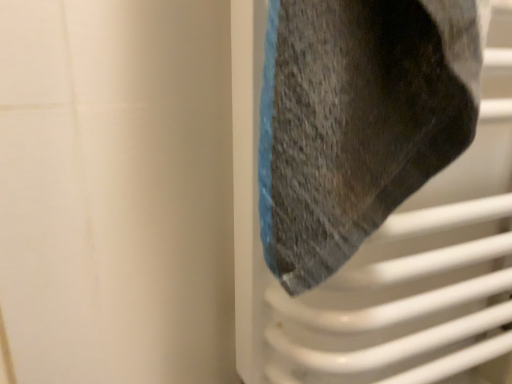
Locate an element on the screen. textured gray towel at upper right is located at coordinates (357, 120).

What do you see at coordinates (357, 120) in the screenshot?
I see `textured gray towel at upper right` at bounding box center [357, 120].

Locate an element on the screen. The image size is (512, 384). textured gray towel at upper right is located at coordinates (357, 120).